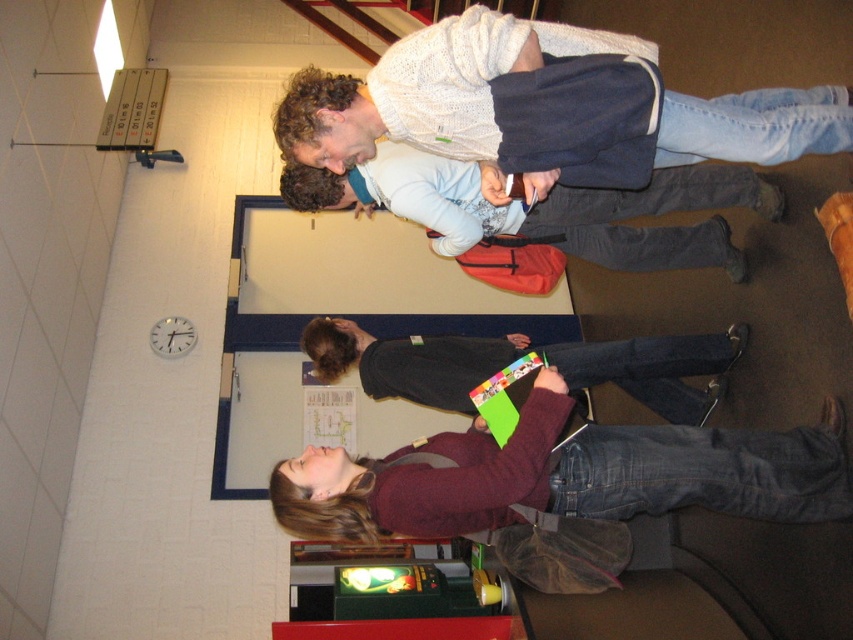
You are standing in the hallway and see the knitted white sweater at upper center and the matte blue backpack at center. Which object is located higher up in the image?

The knitted white sweater at upper center is positioned over the matte blue backpack at center, so it is higher up.

You are standing in the hallway and see the matte blue backpack at center and the dark gray sweater at center. Which object is taller?

The matte blue backpack at center is much taller than the dark gray sweater at center.

Where is the maroon fabric shirt at lower center located in the image?

The maroon fabric shirt at lower center is located at point (561, 484).